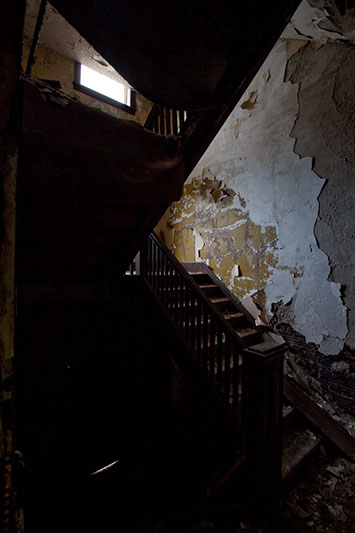
I want to click on peeling wall, so click(x=315, y=181).